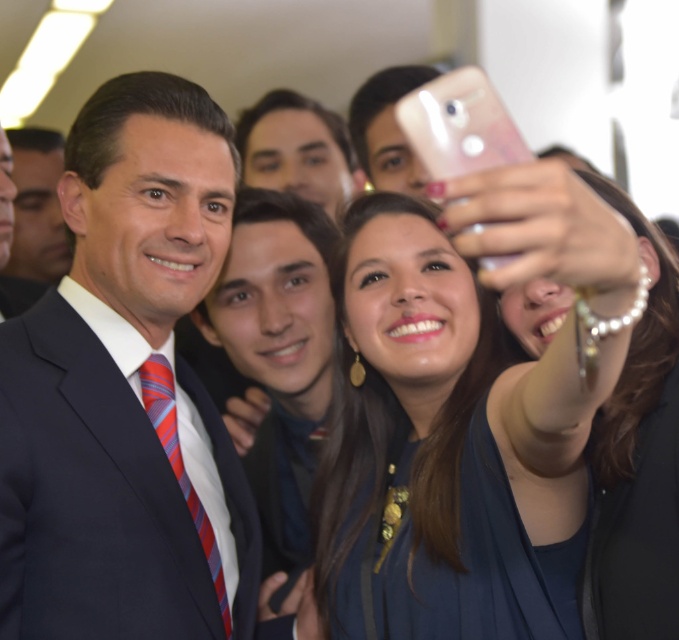
You are a photographer trying to adjust the lighting for a group photo. The matte black suit at center is positioned at coordinates 0.608 on the x axis and 0.183 on the y axis. If you want to ensure the suit is well lit, where should you place the light source relative to the camera?

The matte black suit at center is positioned at coordinates 0.608 on the x axis and 0.183 on the y axis. To ensure proper lighting, the light source should be placed in front of the camera, slightly to the right and above the subject to avoid shadows.

You are organizing a photo shoot and need to ensure that all participants are visible in the frame. Given that the matte black suit at center and the blue fabric dress at center are the main focal points, which one might require more space to ensure it is fully captured in the photo?

The blue fabric dress at center requires more space because it occupies more area than the matte black suit at center, so it should be positioned to ensure it is fully visible in the photo.